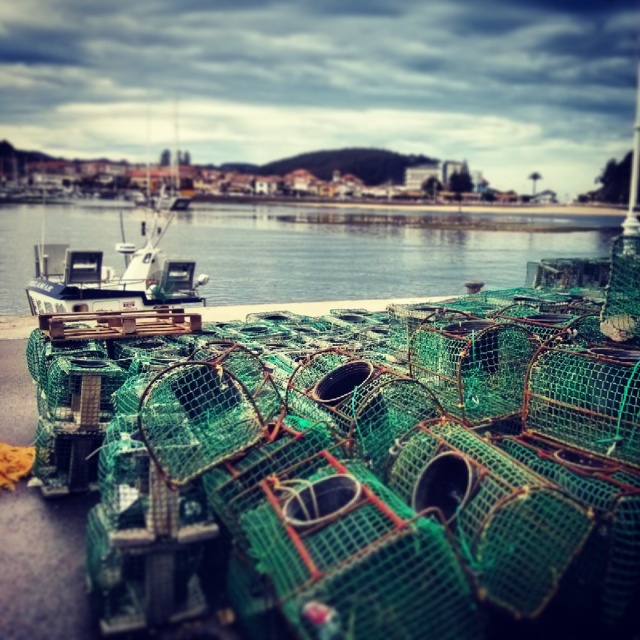
Image resolution: width=640 pixels, height=640 pixels. What do you see at coordinates (369, 250) in the screenshot?
I see `clear blue water at center` at bounding box center [369, 250].

Between clear blue water at center and white plastic boat at center, which one is positioned higher?

clear blue water at center is above.

Does point (77, 236) come closer to viewer compared to point (49, 288)?

No, (77, 236) is behind (49, 288).

Identify the location of clear blue water at center. The width and height of the screenshot is (640, 640). (369, 250).